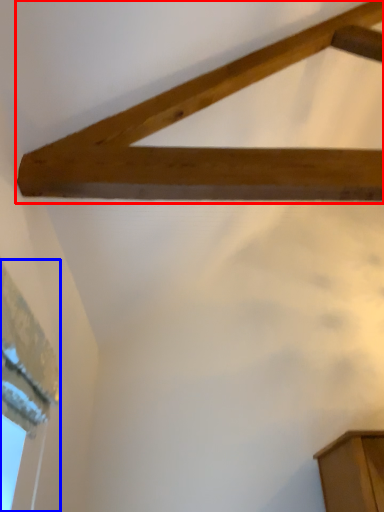
Question: Which of the following is the closest to the observer, plank (highlighted by a red box) or window (highlighted by a blue box)?

Choices:
 (A) plank
 (B) window

Answer: (B)